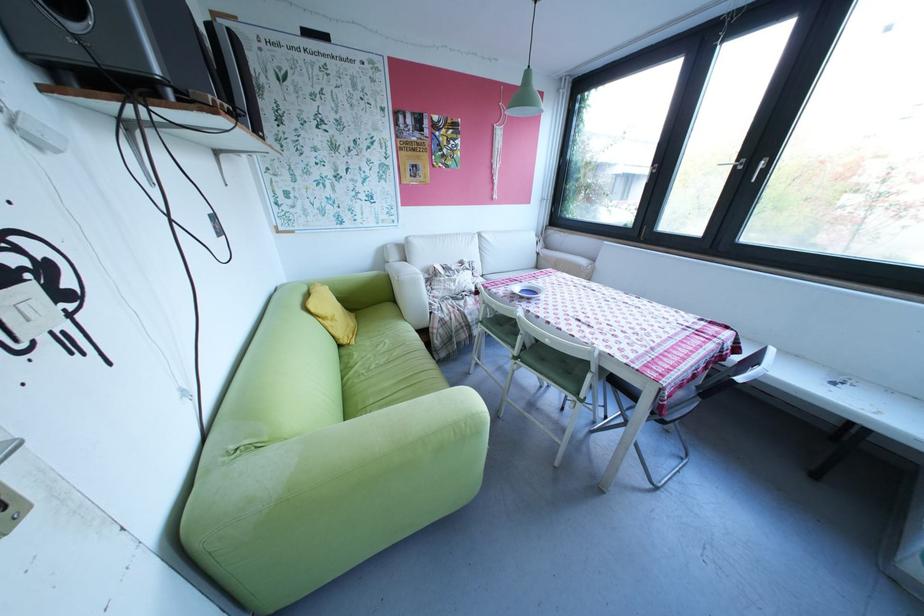
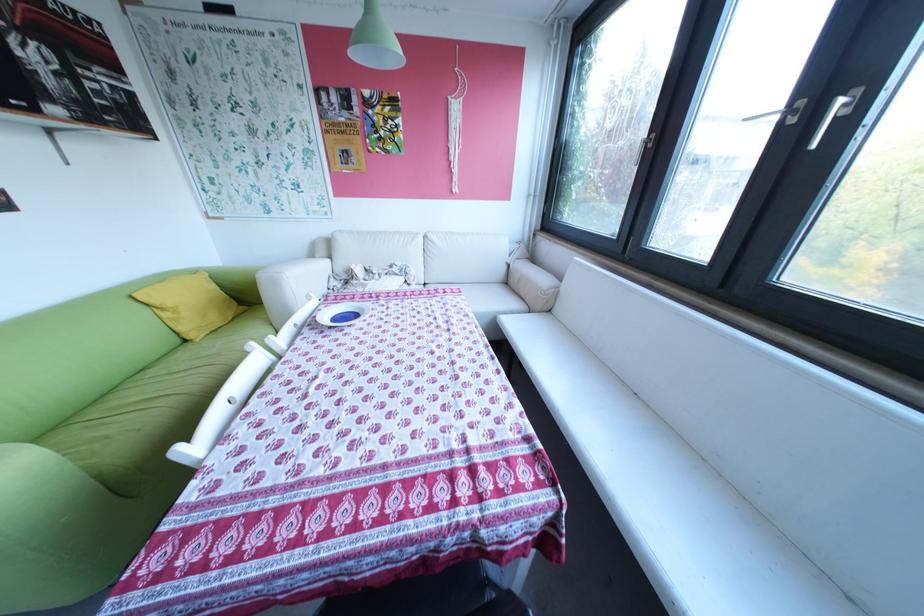
Where in the second image is the point corresponding to (339,323) from the first image?

(177, 314)